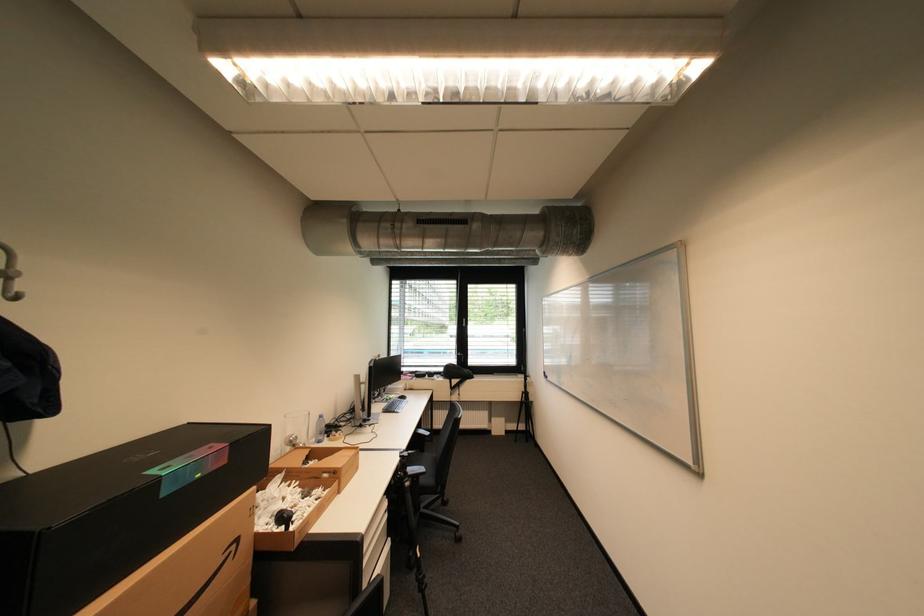
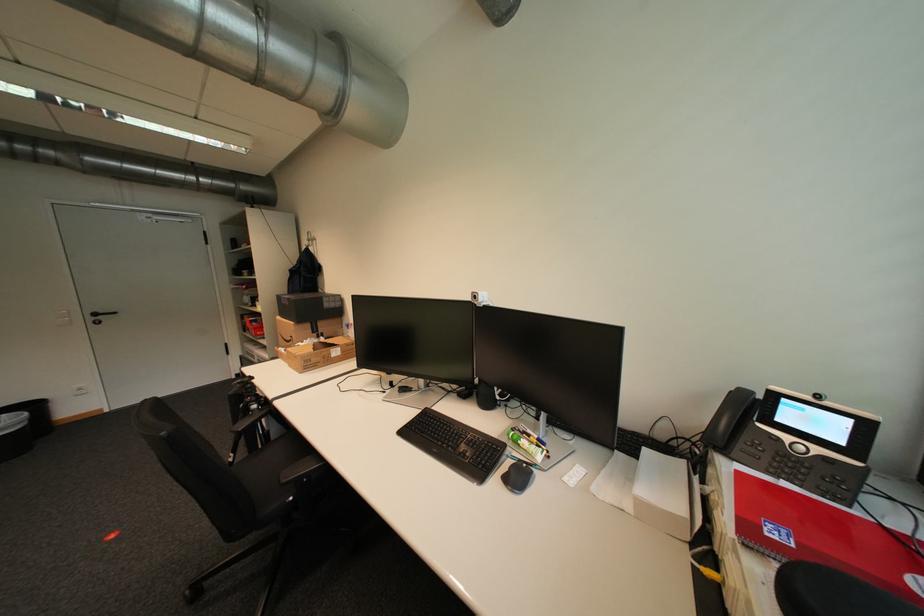
Locate, in the second image, the point that corresponds to (x=232, y=554) in the first image.

(299, 338)